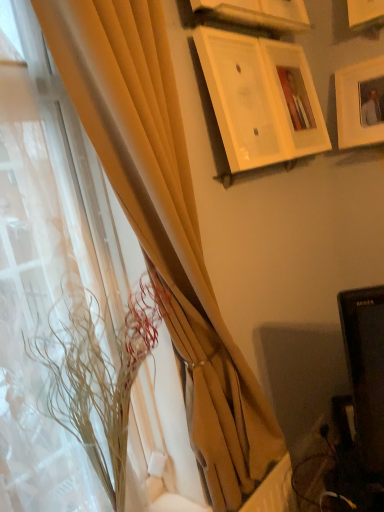
Question: Considering the relative sizes of white glossy picture frame at upper center, the 4th picture frame from the right, and white matte picture frame at upper right, the fourth picture frame in the left-to-right sequence, in the image provided, is white glossy picture frame at upper center, the 4th picture frame from the right, taller than white matte picture frame at upper right, the fourth picture frame in the left-to-right sequence,?

Choices:
 (A) yes
 (B) no

Answer: (A)

Question: Considering the relative sizes of white glossy picture frame at upper center, the 1th picture frame from the left, and white matte picture frame at upper right, the fourth picture frame in the left-to-right sequence, in the image provided, is white glossy picture frame at upper center, the 1th picture frame from the left, wider than white matte picture frame at upper right, the fourth picture frame in the left-to-right sequence,?

Choices:
 (A) yes
 (B) no

Answer: (B)

Question: Is white glossy picture frame at upper center, the 1th picture frame from the left, thinner than white matte picture frame at upper right, which is the first picture frame from right to left?

Choices:
 (A) no
 (B) yes

Answer: (B)

Question: Is white glossy picture frame at upper center, the 1th picture frame from the left, bigger than white matte picture frame at upper right, the fourth picture frame in the left-to-right sequence?

Choices:
 (A) no
 (B) yes

Answer: (B)

Question: Is white glossy picture frame at upper center, the 1th picture frame from the left, closer to camera compared to white matte picture frame at upper right, which is the first picture frame from right to left?

Choices:
 (A) no
 (B) yes

Answer: (B)

Question: From the image's perspective, relative to matte yellow curtain at left, arranged as the first curtain when viewed from the right, is white glossy picture frame at upper center, the 1th picture frame from the left, above or below?

Choices:
 (A) above
 (B) below

Answer: (A)

Question: Is white glossy picture frame at upper center, the 4th picture frame from the right, spatially inside matte yellow curtain at left, arranged as the first curtain when viewed from the right, or outside of it?

Choices:
 (A) outside
 (B) inside

Answer: (A)

Question: Would you say white glossy picture frame at upper center, the 1th picture frame from the left, is to the left or to the right of matte yellow curtain at left, the second curtain in the left-to-right sequence, in the picture?

Choices:
 (A) left
 (B) right

Answer: (B)

Question: From a real-world perspective, is white glossy picture frame at upper center, the 4th picture frame from the right, physically located above or below matte yellow curtain at left, the second curtain in the left-to-right sequence?

Choices:
 (A) above
 (B) below

Answer: (A)

Question: In the image, is wooden picture frame at upper center, which is the 3th picture frame in left-to-right order, on the left side or the right side of matte yellow curtain at left, positioned as the 2th curtain in right-to-left order?

Choices:
 (A) right
 (B) left

Answer: (A)

Question: From the image's perspective, relative to matte yellow curtain at left, the 1th curtain positioned from the left, is wooden picture frame at upper center, which is counted as the 2th picture frame, starting from the right, above or below?

Choices:
 (A) below
 (B) above

Answer: (B)

Question: From a real-world perspective, relative to matte yellow curtain at left, positioned as the 2th curtain in right-to-left order, is wooden picture frame at upper center, which is counted as the 2th picture frame, starting from the right, vertically above or below?

Choices:
 (A) above
 (B) below

Answer: (A)

Question: In the image, is wooden picture frame at upper center, which is counted as the 2th picture frame, starting from the right, positioned in front of or behind matte yellow curtain at left, positioned as the 2th curtain in right-to-left order?

Choices:
 (A) front
 (B) behind

Answer: (B)

Question: Is matte yellow curtain at left, arranged as the first curtain when viewed from the right, wider or thinner than matte yellow curtain at left, positioned as the 2th curtain in right-to-left order?

Choices:
 (A) wide
 (B) thin

Answer: (A)

Question: Does point (183, 238) appear closer or farther from the camera than point (13, 118)?

Choices:
 (A) farther
 (B) closer

Answer: (B)